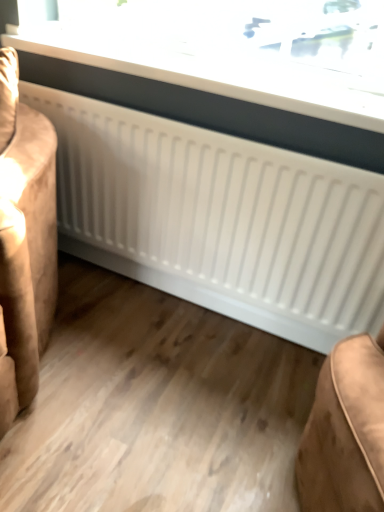
Question: In the image, is white matte radiator at lower center positioned in front of or behind white glossy radiator at upper center?

Choices:
 (A) front
 (B) behind

Answer: (A)

Question: Is white matte radiator at lower center bigger or smaller than white glossy radiator at upper center?

Choices:
 (A) small
 (B) big

Answer: (B)

Question: From the image's perspective, is white matte radiator at lower center above or below white glossy radiator at upper center?

Choices:
 (A) below
 (B) above

Answer: (A)

Question: Based on their positions, is white glossy radiator at upper center located to the left or right of white matte radiator at lower center?

Choices:
 (A) right
 (B) left

Answer: (A)

Question: Is white glossy radiator at upper center situated inside white matte radiator at lower center or outside?

Choices:
 (A) outside
 (B) inside

Answer: (A)

Question: Looking at their shapes, would you say white glossy radiator at upper center is wider or thinner than white matte radiator at lower center?

Choices:
 (A) thin
 (B) wide

Answer: (A)

Question: Is white glossy radiator at upper center in front of or behind white matte radiator at lower center in the image?

Choices:
 (A) front
 (B) behind

Answer: (B)